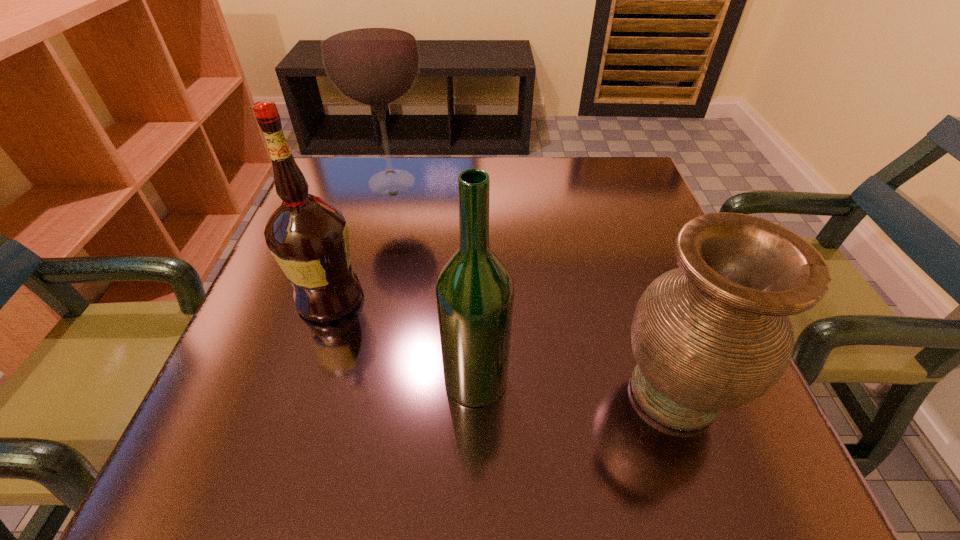
In order to click on vacant area at the near left corner in this screenshot , I will do `click(224, 445)`.

This screenshot has height=540, width=960. In the image, there is a desktop. What are the coordinates of `vacant area at the far right corner` in the screenshot? It's located at (612, 183).

Locate an element on the screen. The height and width of the screenshot is (540, 960). vacant point at the near right corner is located at coordinates (711, 473).

You are a GUI agent. You are given a task and a screenshot of the screen. Output one action in this format:
    pyautogui.click(x=<x>, y=<y>)
    Task: Click on the free point between the nearest alcohol and the rightmost object
    This screenshot has width=960, height=540.
    Given the screenshot: What is the action you would take?
    pyautogui.click(x=575, y=385)

In order to click on free space that is in between the shortest object and the nearest alcohol in this screenshot , I will do `click(575, 385)`.

Where is `vacant region between the second nearest alcohol and the nearest alcohol`? vacant region between the second nearest alcohol and the nearest alcohol is located at coordinates [x=403, y=339].

You are a GUI agent. You are given a task and a screenshot of the screen. Output one action in this format:
    pyautogui.click(x=<x>, y=<y>)
    Task: Click on the free spot between the vase and the farthest alcohol
    The height and width of the screenshot is (540, 960).
    Given the screenshot: What is the action you would take?
    pyautogui.click(x=533, y=287)

At what (x,y) coordinates should I click in order to perform the action: click on vacant space in between the farthest alcohol and the rightmost object. Please return your answer as a coordinate pair (x, y). The width and height of the screenshot is (960, 540). Looking at the image, I should click on (533, 287).

At what (x,y) coordinates should I click in order to perform the action: click on free space between the farthest alcohol and the second farthest alcohol. Please return your answer as a coordinate pair (x, y). The width and height of the screenshot is (960, 540). Looking at the image, I should click on click(361, 240).

I want to click on free space between the farthest alcohol and the vase, so click(533, 287).